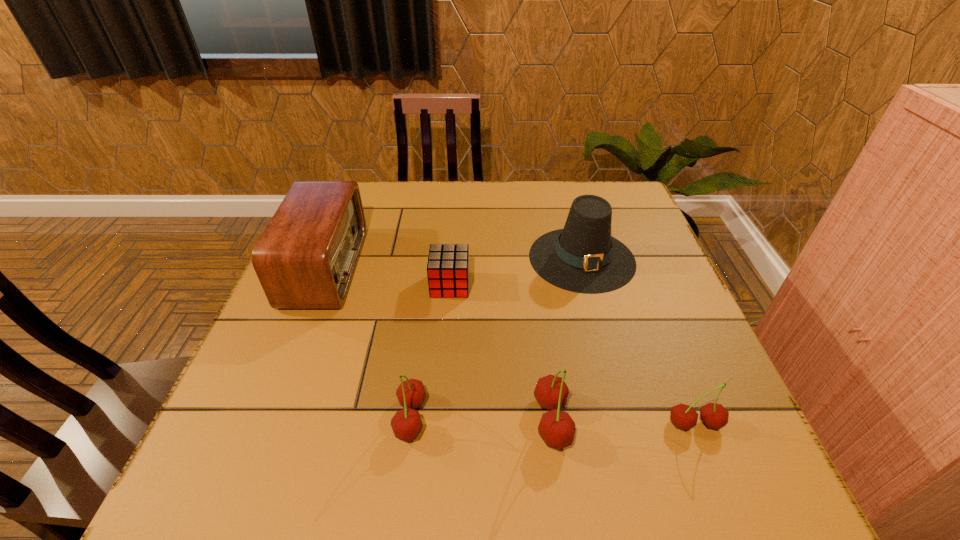
Find the location of a particular element. vacant spot to place a cherry on the left is located at coordinates (271, 415).